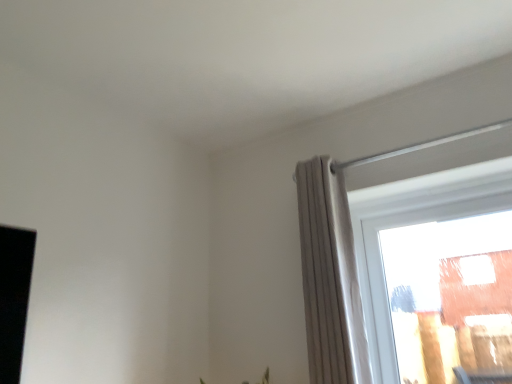
What do you see at coordinates (330, 277) in the screenshot? I see `light gray pleated curtain at right` at bounding box center [330, 277].

Image resolution: width=512 pixels, height=384 pixels. What are the coordinates of `light gray pleated curtain at right` in the screenshot? It's located at (330, 277).

Describe the element at coordinates (450, 296) in the screenshot. I see `transparent glass window at upper right` at that location.

Find the location of a particular element. The image size is (512, 384). transparent glass window at upper right is located at coordinates (450, 296).

Locate an element on the screen. The height and width of the screenshot is (384, 512). light gray pleated curtain at right is located at coordinates (330, 277).

Which object is positioned more to the right, transparent glass window at upper right or light gray pleated curtain at right?

transparent glass window at upper right.

Considering their positions, is transparent glass window at upper right located in front of or behind light gray pleated curtain at right?

In the image, transparent glass window at upper right appears behind light gray pleated curtain at right.

Which is behind, point (394, 234) or point (352, 232)?

The point (394, 234) is farther.

From the image's perspective, which object appears higher, transparent glass window at upper right or light gray pleated curtain at right?

From the image's view, light gray pleated curtain at right is above.

From a real-world perspective, is transparent glass window at upper right over light gray pleated curtain at right?

Actually, transparent glass window at upper right is physically below light gray pleated curtain at right in the real world.

Does transparent glass window at upper right have a lesser width compared to light gray pleated curtain at right?

Yes.

Considering the sizes of objects transparent glass window at upper right and light gray pleated curtain at right in the image provided, who is taller, transparent glass window at upper right or light gray pleated curtain at right?

light gray pleated curtain at right is taller.

Is transparent glass window at upper right bigger than light gray pleated curtain at right?

No, transparent glass window at upper right is not bigger than light gray pleated curtain at right.

Is transparent glass window at upper right not within light gray pleated curtain at right?

Yes, transparent glass window at upper right is outside of light gray pleated curtain at right.

Is transparent glass window at upper right not close to light gray pleated curtain at right?

Actually, transparent glass window at upper right and light gray pleated curtain at right are a little close together.

Is transparent glass window at upper right facing away from light gray pleated curtain at right?

No.

The image size is (512, 384). I want to click on window below the light gray pleated curtain at right (from the image's perspective), so click(x=450, y=296).

Which is more to the right, light gray pleated curtain at right or transparent glass window at upper right?

transparent glass window at upper right.

Is light gray pleated curtain at right further to camera compared to transparent glass window at upper right?

No, light gray pleated curtain at right is closer to the camera.

Which is in front, point (306, 167) or point (483, 345)?

The point (306, 167) is more forward.

From the image's perspective, is light gray pleated curtain at right below transparent glass window at upper right?

No, from the image's perspective, light gray pleated curtain at right is not beneath transparent glass window at upper right.

From a real-world perspective, is light gray pleated curtain at right under transparent glass window at upper right?

No, from a real-world perspective, light gray pleated curtain at right is not beneath transparent glass window at upper right.

Which object is thinner, light gray pleated curtain at right or transparent glass window at upper right?

With smaller width is transparent glass window at upper right.

Which of these two, light gray pleated curtain at right or transparent glass window at upper right, stands taller?

With more height is light gray pleated curtain at right.

Is light gray pleated curtain at right smaller than transparent glass window at upper right?

Actually, light gray pleated curtain at right might be larger than transparent glass window at upper right.

Is light gray pleated curtain at right positioned beyond the bounds of transparent glass window at upper right?

Absolutely, light gray pleated curtain at right is external to transparent glass window at upper right.

Is there a large distance between light gray pleated curtain at right and transparent glass window at upper right?

light gray pleated curtain at right is near transparent glass window at upper right, not far away.

Could you tell me if light gray pleated curtain at right is facing transparent glass window at upper right?

No, light gray pleated curtain at right is not turned towards transparent glass window at upper right.

How different are the orientations of light gray pleated curtain at right and transparent glass window at upper right in degrees?

light gray pleated curtain at right and transparent glass window at upper right are facing 0.349 degrees away from each other.

There is a transparent glass window at upper right. Where is `curtain above it (from a real-world perspective)`? curtain above it (from a real-world perspective) is located at coordinates (330, 277).

The height and width of the screenshot is (384, 512). What are the coordinates of `curtain that is in front of the transparent glass window at upper right` in the screenshot? It's located at (330, 277).

Find the location of a particular element. This screenshot has height=384, width=512. curtain that is on the left side of transparent glass window at upper right is located at coordinates (330, 277).